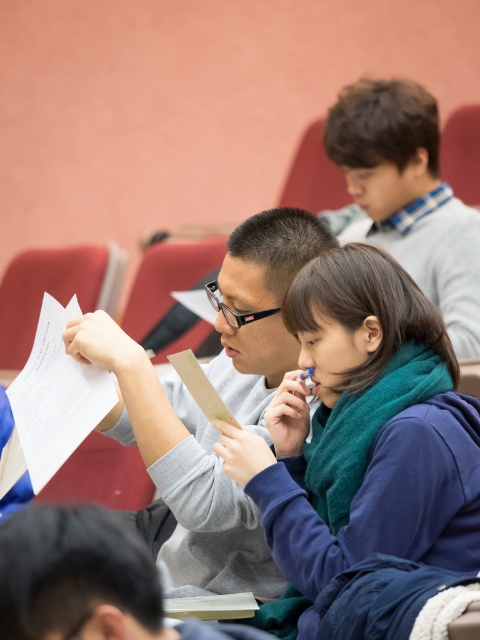
You are a student in the lecture hall and want to hand a paper to the person at point (x=157, y=388). If your arm can reach 1.5 meters, can you reach them?

The distance between you and the person at point (x=157, y=388) is 2.07 meters, so you cannot reach them with an arm span of 1.5 meters.